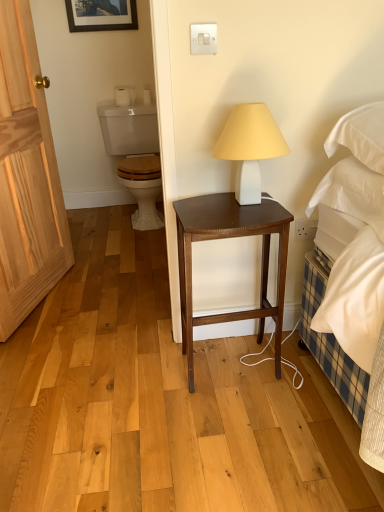
What do you see at coordinates (250, 147) in the screenshot?
I see `white matte lamp at center` at bounding box center [250, 147].

What do you see at coordinates (101, 15) in the screenshot? I see `matte black picture frame at upper center` at bounding box center [101, 15].

What do you see at coordinates (124, 95) in the screenshot? The image size is (384, 512). I see `white matte toilet paper at upper left` at bounding box center [124, 95].

Where is `natural wood door at left`? The image size is (384, 512). natural wood door at left is located at coordinates (26, 177).

Locate an element on the screen. This screenshot has height=512, width=384. white matte lamp at center is located at coordinates (250, 147).

Looking at this image, is matte black picture frame at upper center next to white matte lamp at center and touching it?

matte black picture frame at upper center and white matte lamp at center are clearly separated.

Is matte black picture frame at upper center oriented away from white matte lamp at center?

matte black picture frame at upper center does not have its back to white matte lamp at center.

What's the angular difference between matte black picture frame at upper center and white matte lamp at center's facing directions?

2.06 degrees separate the facing orientations of matte black picture frame at upper center and white matte lamp at center.

Which of these two, matte black picture frame at upper center or white matte toilet paper at upper left, is wider?

white matte toilet paper at upper left.

Considering the sizes of objects matte black picture frame at upper center and white matte toilet paper at upper left in the image provided, who is taller, matte black picture frame at upper center or white matte toilet paper at upper left?

matte black picture frame at upper center.

I want to click on toilet paper directly beneath the matte black picture frame at upper center (from a real-world perspective), so click(x=124, y=95).

Is matte black picture frame at upper center inside the boundaries of white matte toilet paper at upper left, or outside?

matte black picture frame at upper center is not inside white matte toilet paper at upper left, it's outside.

Considering the relative sizes of white matte toilet paper at upper left and white glossy toilet at upper left in the image provided, is white matte toilet paper at upper left smaller than white glossy toilet at upper left?

Correct, white matte toilet paper at upper left occupies less space than white glossy toilet at upper left.

Does white matte toilet paper at upper left have a lesser height compared to white glossy toilet at upper left?

Correct, white matte toilet paper at upper left is not as tall as white glossy toilet at upper left.

From the picture: From the image's perspective, is white matte toilet paper at upper left under white glossy toilet at upper left?

No, from the image's perspective, white matte toilet paper at upper left is not below white glossy toilet at upper left.

From a real-world perspective, is white matte toilet paper at upper left physically below white glossy toilet at upper left?

Incorrect, from a real-world perspective, white matte toilet paper at upper left is higher than white glossy toilet at upper left.

Is white matte toilet paper at upper left next to white plastic power outlet at lower right?

No, white matte toilet paper at upper left is not beside white plastic power outlet at lower right.

From the image's perspective, is white matte toilet paper at upper left above or below white plastic power outlet at lower right?

Based on their image positions, white matte toilet paper at upper left is located above white plastic power outlet at lower right.

Can white plastic power outlet at lower right be found inside white matte toilet paper at upper left?

That's incorrect, white plastic power outlet at lower right is not inside white matte toilet paper at upper left.

Considering their positions, is white matte toilet paper at upper left located in front of or behind white plastic power outlet at lower right?

Clearly, white matte toilet paper at upper left is behind white plastic power outlet at lower right.

Which of these two, white glossy toilet at upper left or white matte toilet paper at upper left, stands shorter?

With less height is white matte toilet paper at upper left.

Is white glossy toilet at upper left not close to white matte toilet paper at upper left?

Actually, white glossy toilet at upper left and white matte toilet paper at upper left are a little close together.

Can you confirm if white glossy toilet at upper left is positioned to the left of white matte toilet paper at upper left?

No, white glossy toilet at upper left is not to the left of white matte toilet paper at upper left.

Between white glossy toilet at upper left and white matte toilet paper at upper left, which one has larger width?

white glossy toilet at upper left is wider.

Between point (297, 222) and point (4, 53), which one is positioned behind?

Positioned behind is point (4, 53).

Does white plastic power outlet at lower right have a lesser width compared to natural wood door at left?

Indeed, white plastic power outlet at lower right has a lesser width compared to natural wood door at left.

Is white plastic power outlet at lower right to the left of natural wood door at left from the viewer's perspective?

In fact, white plastic power outlet at lower right is to the right of natural wood door at left.

How different are the orientations of white plastic power outlet at lower right and natural wood door at left in degrees?

white plastic power outlet at lower right and natural wood door at left are facing 76.2 degrees away from each other.

The image size is (384, 512). Identify the location of toilet paper behind the white soft pillow at right. (124, 95).

From the image's perspective, which object appears higher, white soft pillow at right or white matte toilet paper at upper left?

white matte toilet paper at upper left appears higher in the image.

Is white soft pillow at right bigger than white matte toilet paper at upper left?

Yes, white soft pillow at right is bigger than white matte toilet paper at upper left.

The width and height of the screenshot is (384, 512). I want to click on lamp below the matte black picture frame at upper center (from the image's perspective), so (x=250, y=147).

Find the location of a particular element. The height and width of the screenshot is (512, 384). picture frame that is above the white matte toilet paper at upper left (from the image's perspective) is located at coordinates (101, 15).

Estimate the real-world distances between objects in this image. Which object is closer to natural wood door at left, white soft pillow at right or white plastic power outlet at lower right?

The object closer to natural wood door at left is white plastic power outlet at lower right.

Estimate the real-world distances between objects in this image. Which object is closer to natural wood door at left, matte black picture frame at upper center or white soft pillow at right?

matte black picture frame at upper center lies closer to natural wood door at left than the other object.

Looking at the image, which one is located further to natural wood door at left, white glossy toilet at upper left or dark wood stool at center?

Among the two, dark wood stool at center is located further to natural wood door at left.

Consider the image. From the image, which object appears to be farther from natural wood door at left, matte black picture frame at upper center or white matte toilet paper at upper left?

white matte toilet paper at upper left.

From the image, which object appears to be farther from white matte lamp at center, white matte toilet paper at upper left or white plastic power outlet at lower right?

white matte toilet paper at upper left lies further to white matte lamp at center than the other object.

When comparing their distances from white matte lamp at center, does white soft pillow at right or natural wood door at left seem further?

natural wood door at left is further to white matte lamp at center.

From the image, which object appears to be farther from white matte toilet paper at upper left, white soft pillow at right or matte black picture frame at upper center?

Among the two, white soft pillow at right is located further to white matte toilet paper at upper left.

Estimate the real-world distances between objects in this image. Which object is closer to matte black picture frame at upper center, white soft pillow at right or white plastic power outlet at lower right?

white plastic power outlet at lower right lies closer to matte black picture frame at upper center than the other object.

Find the location of a particular element. The height and width of the screenshot is (512, 384). door between white soft pillow at right and matte black picture frame at upper center along the z-axis is located at coordinates (26, 177).

Locate an element on the screen. Image resolution: width=384 pixels, height=512 pixels. lamp between natural wood door at left and white plastic power outlet at lower right in the horizontal direction is located at coordinates (250, 147).

Find the location of a particular element. door that lies between matte black picture frame at upper center and dark wood stool at center from top to bottom is located at coordinates (26, 177).

Identify the location of stool between natural wood door at left and white soft pillow at right from left to right. The image size is (384, 512). pyautogui.click(x=225, y=238).